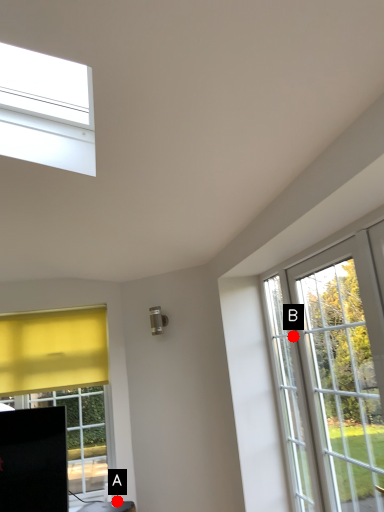
Question: Two points are circled on the image, labeled by A and B beside each circle. Which point appears farthest from the camera in this image?

Choices:
 (A) A is further
 (B) B is further

Answer: (A)